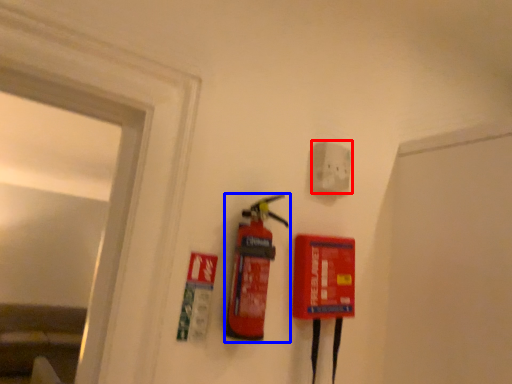
Question: Which of the following is the closest to the observer, electric outlet (highlighted by a red box) or fire extinguisher (highlighted by a blue box)?

Choices:
 (A) electric outlet
 (B) fire extinguisher

Answer: (B)